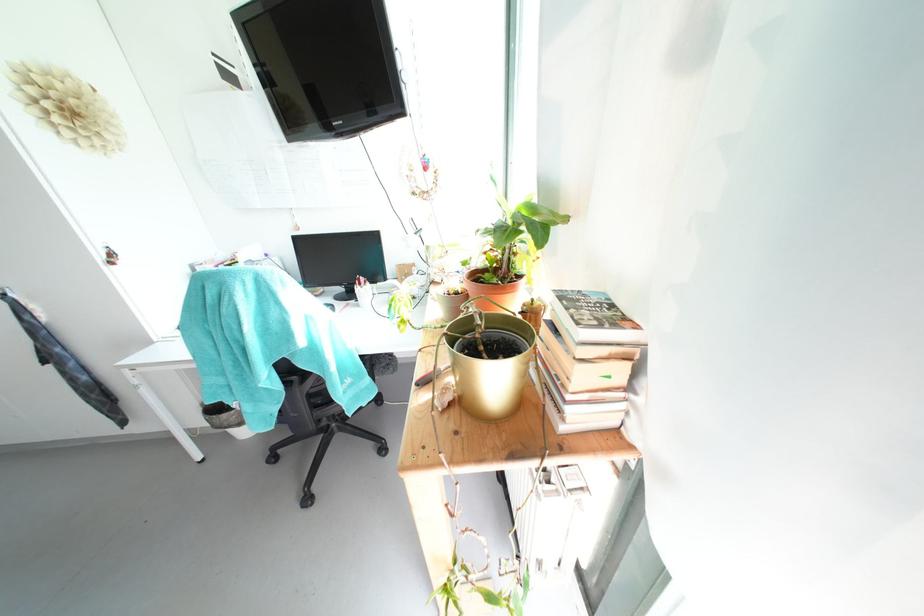
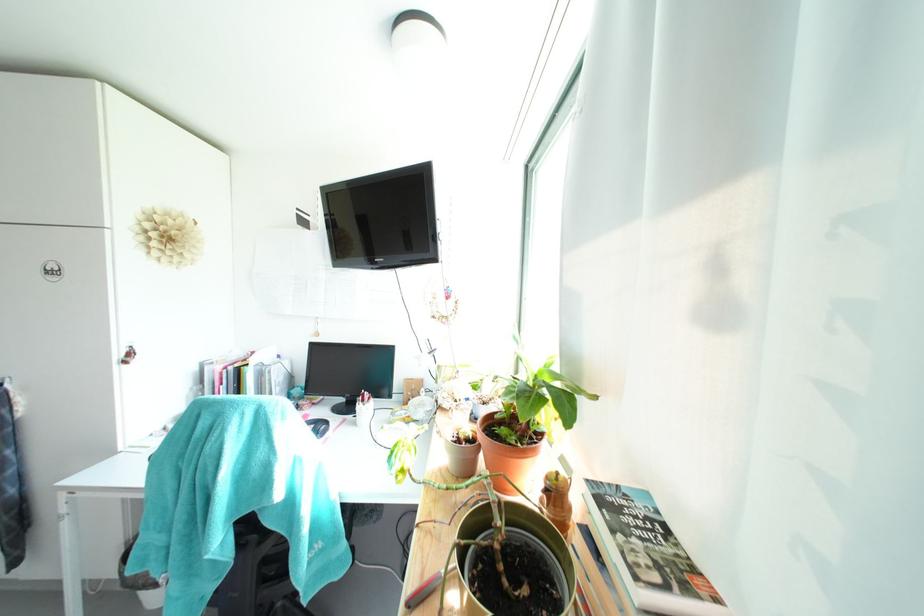
Question: The first image is from the beginning of the video and the second image is from the end. How did the camera likely rotate when shooting the video?

Choices:
 (A) Left
 (B) Right
 (C) Up
 (D) Down

Answer: (C)